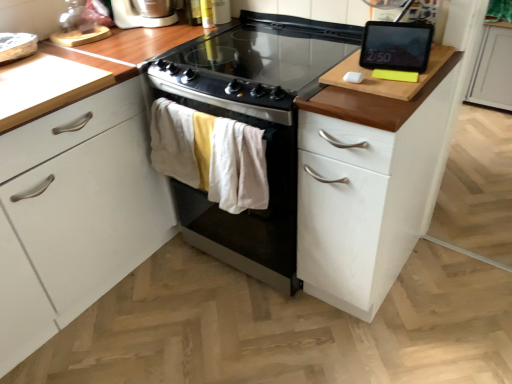
Question: Considering the relative positions of black glass cooktop at center and black glossy tablet at upper right in the image provided, is black glass cooktop at center to the left or to the right of black glossy tablet at upper right?

Choices:
 (A) left
 (B) right

Answer: (A)

Question: Looking at their shapes, would you say black glass cooktop at center is wider or thinner than black glossy tablet at upper right?

Choices:
 (A) wide
 (B) thin

Answer: (A)

Question: Which is farther from the black glossy tablet at upper right?

Choices:
 (A) black glass cooktop at center
 (B) white plastic toaster at upper left
 (C) black glass-top oven at center
 (D) white wood cabinet at right

Answer: (B)

Question: Which of these objects is positioned closest to the white wood cabinet at right?

Choices:
 (A) black glass-top oven at center
 (B) white plastic toaster at upper left
 (C) black glossy tablet at upper right
 (D) black glass cooktop at center

Answer: (A)